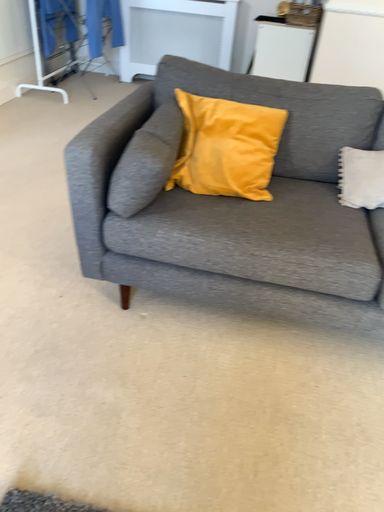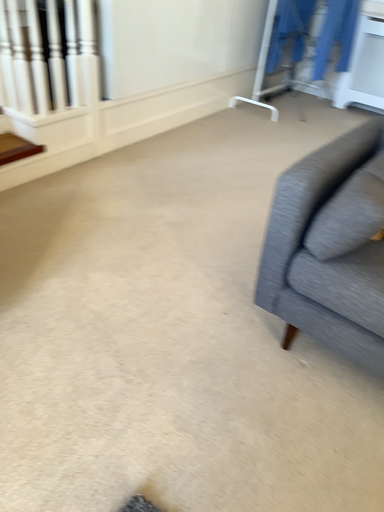
Question: How did the camera likely rotate when shooting the video?

Choices:
 (A) rotated left
 (B) rotated right

Answer: (A)